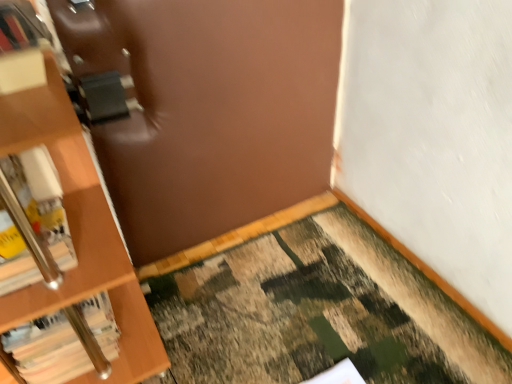
Question: Would you consider white matte book at left, placed as the 2th book when sorted from bottom to top, to be distant from camouflage carpet at lower right?

Choices:
 (A) yes
 (B) no

Answer: (B)

Question: Is white matte book at left, placed as the 2th book when sorted from bottom to top, smaller than camouflage carpet at lower right?

Choices:
 (A) yes
 (B) no

Answer: (A)

Question: Is white matte book at left, placed as the 2th book when sorted from bottom to top, shorter than camouflage carpet at lower right?

Choices:
 (A) no
 (B) yes

Answer: (A)

Question: Would you say white matte book at left, placed as the 1th book when sorted from top to bottom, contains camouflage carpet at lower right?

Choices:
 (A) yes
 (B) no

Answer: (B)

Question: From the image's perspective, is white matte book at left, placed as the 2th book when sorted from bottom to top, beneath camouflage carpet at lower right?

Choices:
 (A) no
 (B) yes

Answer: (A)

Question: Does white matte book at left, placed as the 2th book when sorted from bottom to top, have a larger size compared to camouflage carpet at lower right?

Choices:
 (A) no
 (B) yes

Answer: (A)

Question: Would you say hardcover book at left, which ranks as the 1th book in bottom-to-top order, is part of white matte book at left, placed as the 2th book when sorted from bottom to top,'s contents?

Choices:
 (A) no
 (B) yes

Answer: (A)

Question: Is white matte book at left, placed as the 2th book when sorted from bottom to top, closer to the viewer compared to hardcover book at left, which ranks as the 1th book in bottom-to-top order?

Choices:
 (A) no
 (B) yes

Answer: (B)

Question: From a real-world perspective, does white matte book at left, placed as the 1th book when sorted from top to bottom, sit lower than hardcover book at left, marked as the 2th book in a top-to-bottom arrangement?

Choices:
 (A) yes
 (B) no

Answer: (B)

Question: Is white matte book at left, placed as the 1th book when sorted from top to bottom, smaller than hardcover book at left, which ranks as the 1th book in bottom-to-top order?

Choices:
 (A) no
 (B) yes

Answer: (B)

Question: Can you confirm if white matte book at left, placed as the 2th book when sorted from bottom to top, is positioned to the right of hardcover book at left, marked as the 2th book in a top-to-bottom arrangement?

Choices:
 (A) yes
 (B) no

Answer: (B)

Question: Is white matte book at left, placed as the 2th book when sorted from bottom to top, at the left side of hardcover book at left, marked as the 2th book in a top-to-bottom arrangement?

Choices:
 (A) no
 (B) yes

Answer: (B)

Question: From the image's perspective, would you say hardcover book at left, which ranks as the 1th book in bottom-to-top order, is shown under white matte book at left, placed as the 1th book when sorted from top to bottom?

Choices:
 (A) yes
 (B) no

Answer: (A)